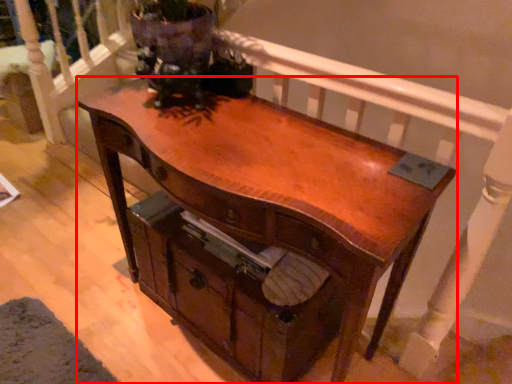
Question: Considering the relative positions of desk (annotated by the red box) and drawer in the image provided, where is desk (annotated by the red box) located with respect to the staircase?

Choices:
 (A) left
 (B) right

Answer: (A)